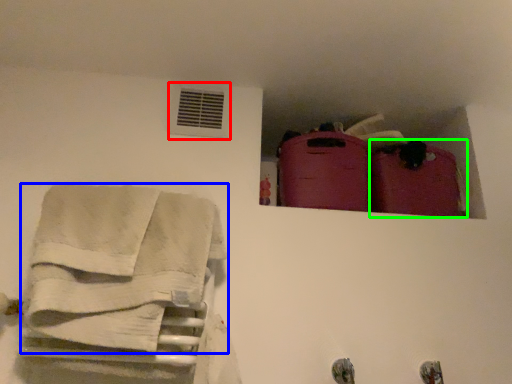
Question: Which object is positioned closest to air conditioning (highlighted by a red box)? Select from towel (highlighted by a blue box) and luggage (highlighted by a green box).

Choices:
 (A) towel
 (B) luggage

Answer: (A)